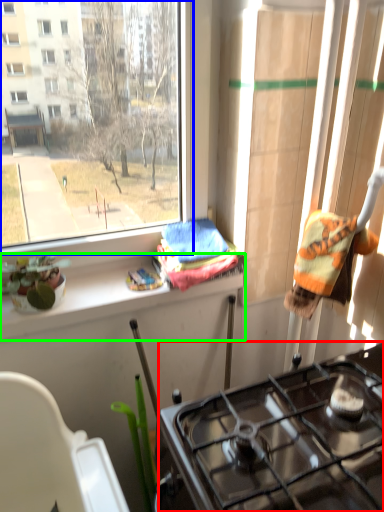
Question: Which object is the closest to the gas stove (highlighted by a red box)? Choose among these: window (highlighted by a blue box) or ledge (highlighted by a green box).

Choices:
 (A) window
 (B) ledge

Answer: (B)